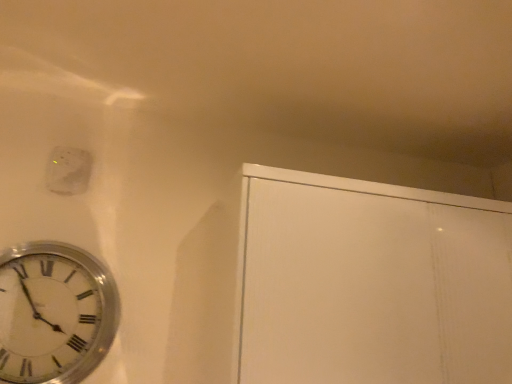
Question: Is the position of white matte electric outlet at upper left less distant than that of white matte cabinet at upper right?

Choices:
 (A) no
 (B) yes

Answer: (A)

Question: From the image's perspective, is white matte electric outlet at upper left located beneath white matte cabinet at upper right?

Choices:
 (A) yes
 (B) no

Answer: (B)

Question: From a real-world perspective, is white matte electric outlet at upper left on white matte cabinet at upper right?

Choices:
 (A) no
 (B) yes

Answer: (B)

Question: Is white matte electric outlet at upper left with white matte cabinet at upper right?

Choices:
 (A) no
 (B) yes

Answer: (A)

Question: Is white matte electric outlet at upper left positioned beyond the bounds of white matte cabinet at upper right?

Choices:
 (A) no
 (B) yes

Answer: (B)

Question: Considering the relative sizes of white matte electric outlet at upper left and white matte cabinet at upper right in the image provided, is white matte electric outlet at upper left thinner than white matte cabinet at upper right?

Choices:
 (A) no
 (B) yes

Answer: (B)

Question: Is white matte electric outlet at upper left wider than silver metallic clock at lower left?

Choices:
 (A) yes
 (B) no

Answer: (B)

Question: Considering the relative positions of white matte electric outlet at upper left and silver metallic clock at lower left in the image provided, is white matte electric outlet at upper left to the right of silver metallic clock at lower left from the viewer's perspective?

Choices:
 (A) yes
 (B) no

Answer: (B)

Question: Considering the relative sizes of white matte electric outlet at upper left and silver metallic clock at lower left in the image provided, is white matte electric outlet at upper left shorter than silver metallic clock at lower left?

Choices:
 (A) yes
 (B) no

Answer: (A)

Question: Could you tell me if white matte electric outlet at upper left is turned towards silver metallic clock at lower left?

Choices:
 (A) yes
 (B) no

Answer: (B)

Question: Does white matte electric outlet at upper left have a smaller size compared to silver metallic clock at lower left?

Choices:
 (A) no
 (B) yes

Answer: (B)

Question: Is white matte electric outlet at upper left thinner than silver metallic clock at lower left?

Choices:
 (A) no
 (B) yes

Answer: (B)

Question: Is white matte cabinet at upper right shorter than silver metallic clock at lower left?

Choices:
 (A) yes
 (B) no

Answer: (B)